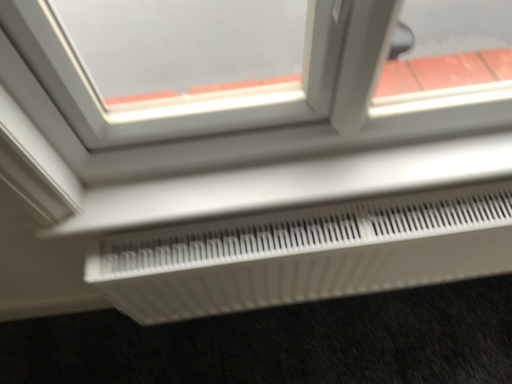
Describe the element at coordinates (306, 253) in the screenshot. I see `white plastic radiator at lower center` at that location.

You are a GUI agent. You are given a task and a screenshot of the screen. Output one action in this format:
    pyautogui.click(x=<x>, y=<y>)
    Task: Click on the white plastic radiator at lower center
    
    Given the screenshot: What is the action you would take?
    pyautogui.click(x=306, y=253)

In order to face white plastic radiator at lower center, should I rotate leftwards or rightwards?

To align with it, rotate right about 5.147°.

This screenshot has height=384, width=512. I want to click on white plastic radiator at lower center, so click(x=233, y=109).

Measure the distance between point (240, 59) and camera.

5.49 feet.

This screenshot has height=384, width=512. What do you see at coordinates (233, 109) in the screenshot?
I see `white plastic radiator at lower center` at bounding box center [233, 109].

Where is `white plastic radiator at lower center`? This screenshot has height=384, width=512. white plastic radiator at lower center is located at coordinates (306, 253).

Which is more to the right, white plastic radiator at lower center or white plastic radiator at lower center?

white plastic radiator at lower center.

Is the position of white plastic radiator at lower center less distant than that of white plastic radiator at lower center?

Yes, it is in front of white plastic radiator at lower center.

Is point (72, 212) less distant than point (154, 292)?

Yes, point (72, 212) is closer to viewer.

From the image's perspective, relative to white plastic radiator at lower center, is white plastic radiator at lower center above or below?

white plastic radiator at lower center is above white plastic radiator at lower center.

From a real-world perspective, which object rests below the other?

In real-world perspective, white plastic radiator at lower center is lower.

Is white plastic radiator at lower center wider than white plastic radiator at lower center?

Indeed, white plastic radiator at lower center has a greater width compared to white plastic radiator at lower center.

Who is shorter, white plastic radiator at lower center or white plastic radiator at lower center?

With less height is white plastic radiator at lower center.

Does white plastic radiator at lower center have a larger size compared to white plastic radiator at lower center?

Actually, white plastic radiator at lower center might be smaller than white plastic radiator at lower center.

Choose the correct answer: Is white plastic radiator at lower center inside white plastic radiator at lower center or outside it?

white plastic radiator at lower center lies outside white plastic radiator at lower center.

Based on the photo, is white plastic radiator at lower center next to white plastic radiator at lower center?

No, white plastic radiator at lower center is not next to white plastic radiator at lower center.

Is white plastic radiator at lower center aimed at white plastic radiator at lower center?

No, white plastic radiator at lower center is not oriented towards white plastic radiator at lower center.

Measure the distance between white plastic radiator at lower center and white plastic radiator at lower center.

A distance of 20.51 centimeters exists between white plastic radiator at lower center and white plastic radiator at lower center.

Locate an element on the screen. This screenshot has width=512, height=384. air conditioning that appears behind the white plastic radiator at lower center is located at coordinates (306, 253).

Between white plastic radiator at lower center and white plastic radiator at lower center, which one appears on the right side from the viewer's perspective?

From the viewer's perspective, white plastic radiator at lower center appears more on the right side.

Is the position of white plastic radiator at lower center more distant than that of white plastic radiator at lower center?

Yes, it is behind white plastic radiator at lower center.

Which is closer to the camera, (230, 265) or (109, 146)?

Point (230, 265) is positioned farther from the camera compared to point (109, 146).

Looking at this image, from the image's perspective, which one is positioned higher, white plastic radiator at lower center or white plastic radiator at lower center?

From the image's view, white plastic radiator at lower center is above.

From a real-world perspective, does white plastic radiator at lower center sit lower than white plastic radiator at lower center?

Yes.

Looking at this image, looking at their sizes, would you say white plastic radiator at lower center is wider or thinner than white plastic radiator at lower center?

white plastic radiator at lower center is thinner than white plastic radiator at lower center.

Which of these two, white plastic radiator at lower center or white plastic radiator at lower center, stands taller?

With more height is white plastic radiator at lower center.

Is white plastic radiator at lower center smaller than white plastic radiator at lower center?

No.

Would you say white plastic radiator at lower center is inside or outside white plastic radiator at lower center?

white plastic radiator at lower center is outside white plastic radiator at lower center.

Is white plastic radiator at lower center with white plastic radiator at lower center?

No, white plastic radiator at lower center is not with white plastic radiator at lower center.

Is white plastic radiator at lower center positioned with its back to white plastic radiator at lower center?

No, white plastic radiator at lower center is not at the back of white plastic radiator at lower center.

How far apart are white plastic radiator at lower center and white plastic radiator at lower center?

8.07 inches.

Where is `air conditioning on the right side of white plastic radiator at lower center`? Image resolution: width=512 pixels, height=384 pixels. air conditioning on the right side of white plastic radiator at lower center is located at coordinates (306, 253).

Where is `window on the left of white plastic radiator at lower center`? This screenshot has width=512, height=384. window on the left of white plastic radiator at lower center is located at coordinates (233, 109).

The width and height of the screenshot is (512, 384). Identify the location of air conditioning behind the white plastic radiator at lower center. (306, 253).